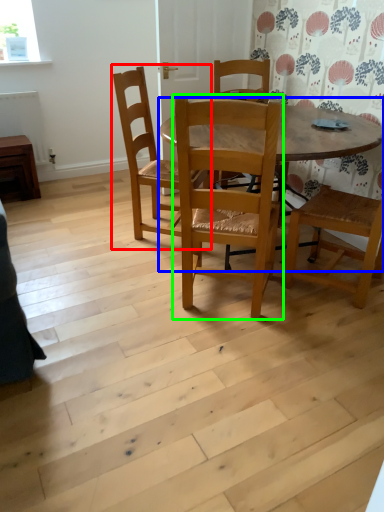
Question: Considering the real-world distances, which object is farthest from chair (highlighted by a red box)? kitchen & dining room table (highlighted by a blue box) or chair (highlighted by a green box)?

Choices:
 (A) kitchen & dining room table
 (B) chair

Answer: (A)